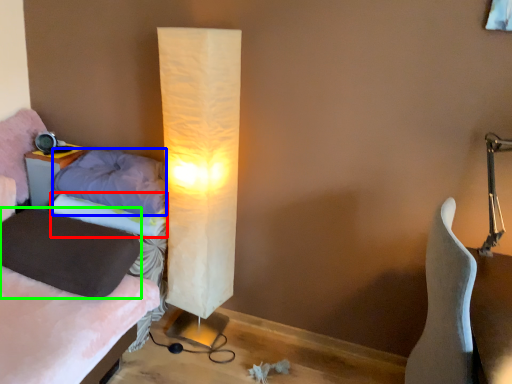
Question: Considering the real-world distances, which object is farthest from pillow (highlighted by a red box)? pillow (highlighted by a blue box) or pillow (highlighted by a green box)?

Choices:
 (A) pillow
 (B) pillow

Answer: (B)